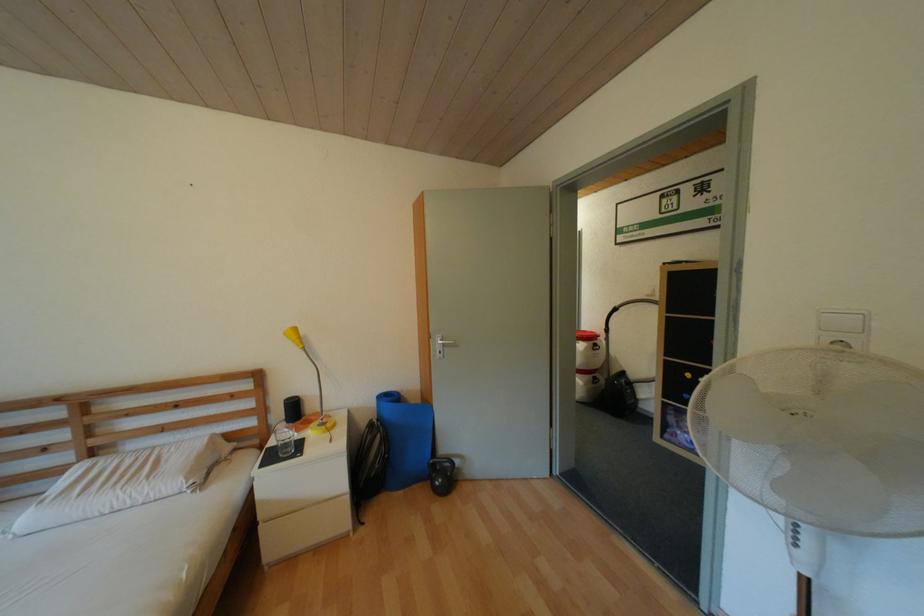
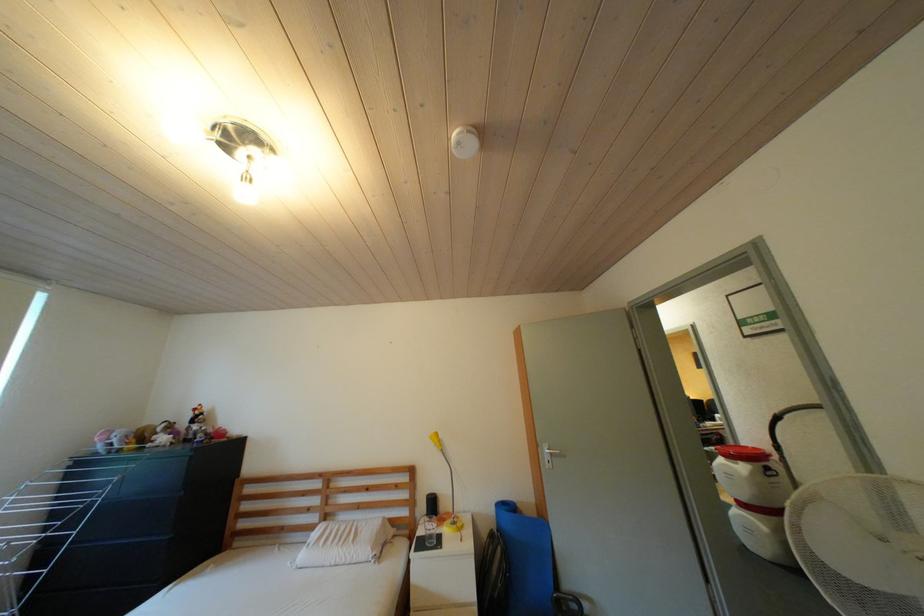
Where in the second image is the point corresponding to point 116,463 from the first image?

(341, 527)